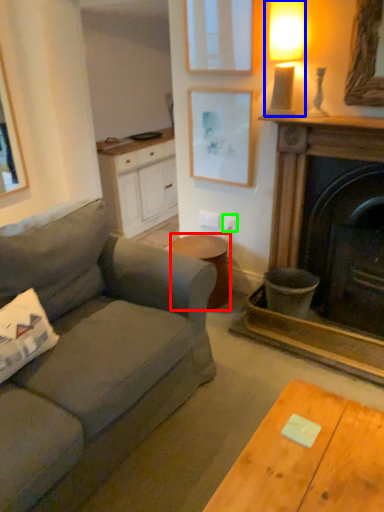
Question: Considering the real-world distances, which object is farthest from stool (highlighted by a red box)? lamp (highlighted by a blue box) or power outlet (highlighted by a green box)?

Choices:
 (A) lamp
 (B) power outlet

Answer: (A)